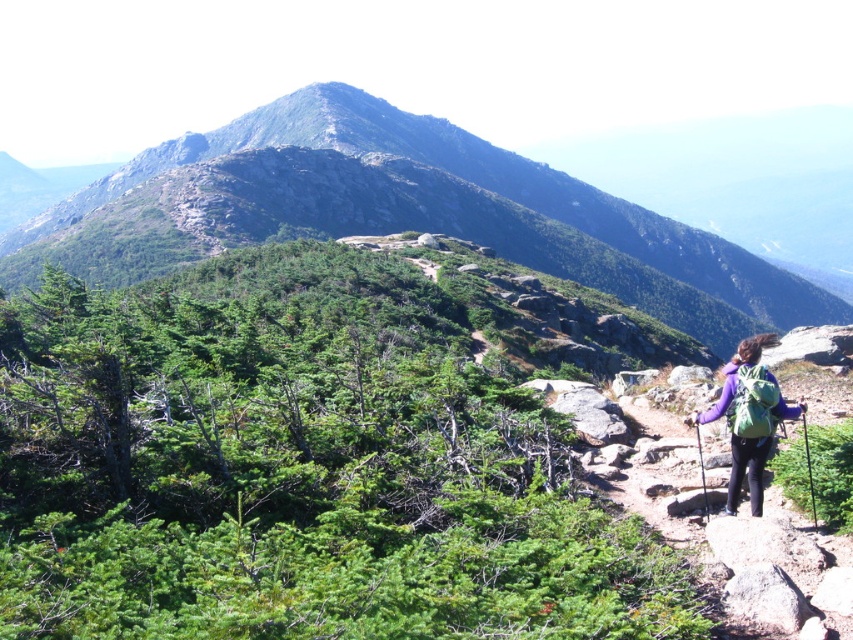
Question: Among these points, which one is farthest from the camera?

Choices:
 (A) pos(758,476)
 (B) pos(291,100)

Answer: (B)

Question: Which object appears farthest from the camera in this image?

Choices:
 (A) purple fabric backpack at lower right
 (B) green rocky mountain at center

Answer: (B)

Question: Where is green rocky mountain at center located in relation to purple fabric backpack at lower right in the image?

Choices:
 (A) above
 (B) below

Answer: (A)

Question: Which object is closer to the camera taking this photo?

Choices:
 (A) green rocky mountain at center
 (B) purple fabric backpack at lower right

Answer: (B)

Question: Does green rocky mountain at center appear on the right side of purple fabric backpack at lower right?

Choices:
 (A) no
 (B) yes

Answer: (A)

Question: Where is green rocky mountain at center located in relation to purple fabric backpack at lower right in the image?

Choices:
 (A) below
 (B) above

Answer: (B)